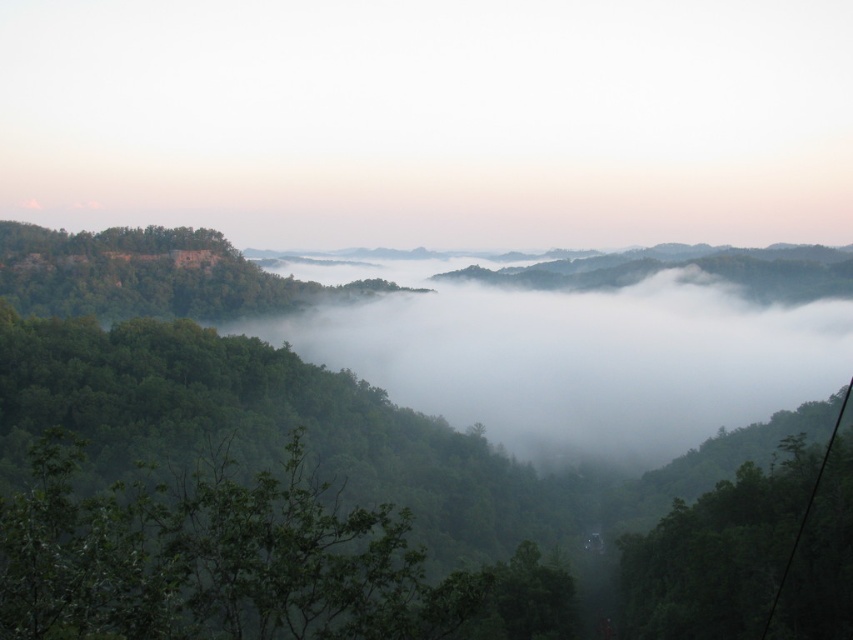
Question: Is green leafy tree at center wider than black wire at lower right?

Choices:
 (A) no
 (B) yes

Answer: (A)

Question: Which point is closer to the camera?

Choices:
 (A) green leafy tree at center
 (B) black wire at lower right

Answer: (A)

Question: Among these objects, which one is nearest to the camera?

Choices:
 (A) green leafy tree at center
 (B) black wire at lower right

Answer: (A)

Question: Is green leafy tree at center closer to camera compared to black wire at lower right?

Choices:
 (A) yes
 (B) no

Answer: (A)

Question: Which point appears farthest from the camera in this image?

Choices:
 (A) (485, 586)
 (B) (793, 540)

Answer: (B)

Question: Is green leafy tree at center positioned before black wire at lower right?

Choices:
 (A) no
 (B) yes

Answer: (B)